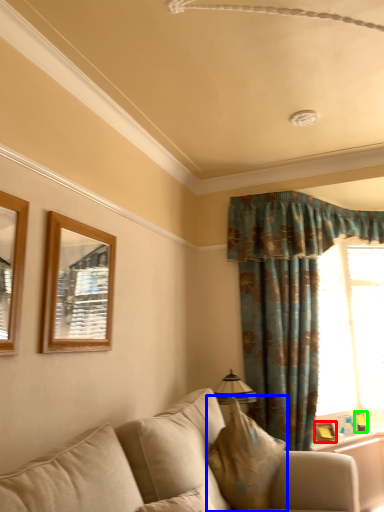
Question: Considering the real-world distances, which object is closest to picture frame (highlighted by a red box)? pillow (highlighted by a blue box) or picture frame (highlighted by a green box).

Choices:
 (A) pillow
 (B) picture frame

Answer: (B)